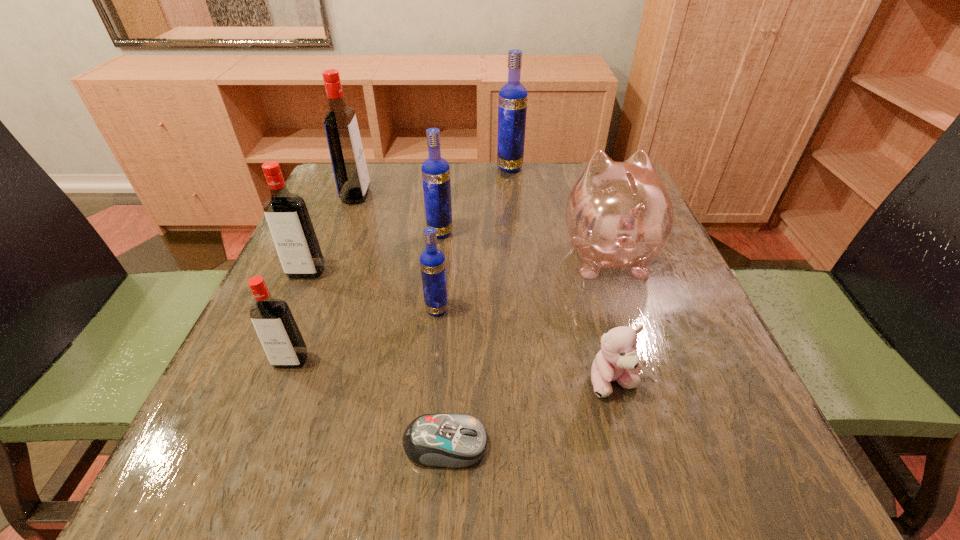
The width and height of the screenshot is (960, 540). I want to click on the farthest blue vodka, so click(x=512, y=104).

Find the location of `the rightmost blue vodka`. the rightmost blue vodka is located at coordinates (512, 104).

Locate an element on the screen. the fifth nearest vodka is located at coordinates (351, 175).

Locate an element on the screen. the biggest red vodka is located at coordinates (351, 175).

Locate an element on the screen. The image size is (960, 540). the fourth nearest vodka is located at coordinates (435, 170).

In order to click on the second farthest blue vodka in this screenshot , I will do `click(435, 170)`.

This screenshot has width=960, height=540. What are the coordinates of `the second nearest red vodka` in the screenshot? It's located at (286, 214).

You are a GUI agent. You are given a task and a screenshot of the screen. Output one action in this format:
    pyautogui.click(x=<x>, y=<y>)
    Task: Click on the fourth farthest vodka
    
    Given the screenshot: What is the action you would take?
    pyautogui.click(x=286, y=214)

Locate an element on the screen. piggy bank is located at coordinates (619, 215).

This screenshot has width=960, height=540. Find the location of `the nearest blue vodka`. the nearest blue vodka is located at coordinates (432, 261).